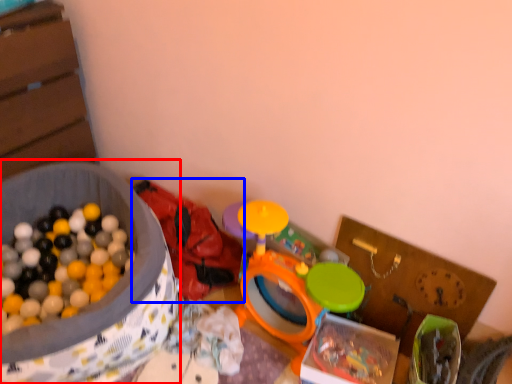
Question: Which object appears farthest to the camera in this image, box (highlighted by a red box) or toy (highlighted by a blue box)?

Choices:
 (A) box
 (B) toy

Answer: (B)